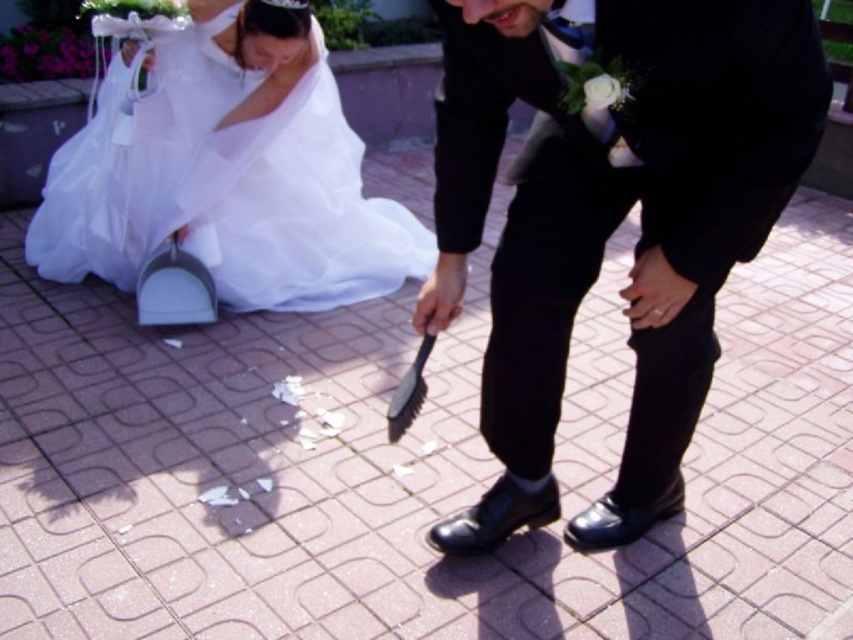
Question: Which point is closer to the camera?

Choices:
 (A) black leather shoes at lower center
 (B) white sheer dress at lower left

Answer: (A)

Question: Is black leather shoes at lower center to the left of white sheer dress at lower left from the viewer's perspective?

Choices:
 (A) no
 (B) yes

Answer: (A)

Question: Is black leather shoes at lower center behind white sheer dress at lower left?

Choices:
 (A) no
 (B) yes

Answer: (A)

Question: Can you confirm if black leather shoes at lower center is positioned to the left of white sheer dress at lower left?

Choices:
 (A) yes
 (B) no

Answer: (B)